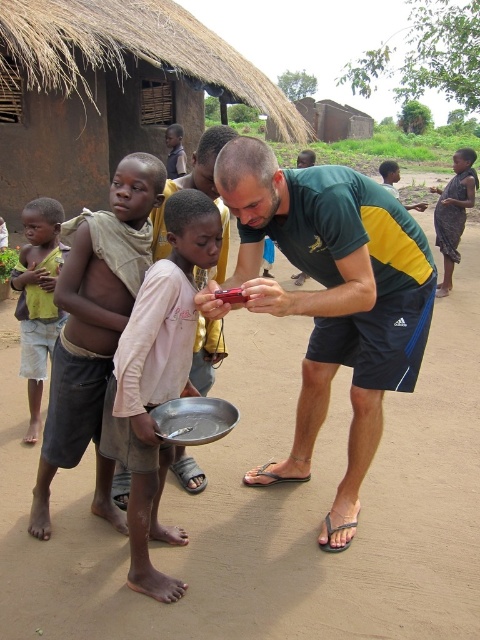
You are a photographer trying to capture a clear image of the metallic silver bowl at center and the dark skin boy at center. Based on their positions, which one is closer to the camera?

The metallic silver bowl at center is in front of the dark skin boy at center, so the metallic silver bowl at center is closer to the camera.